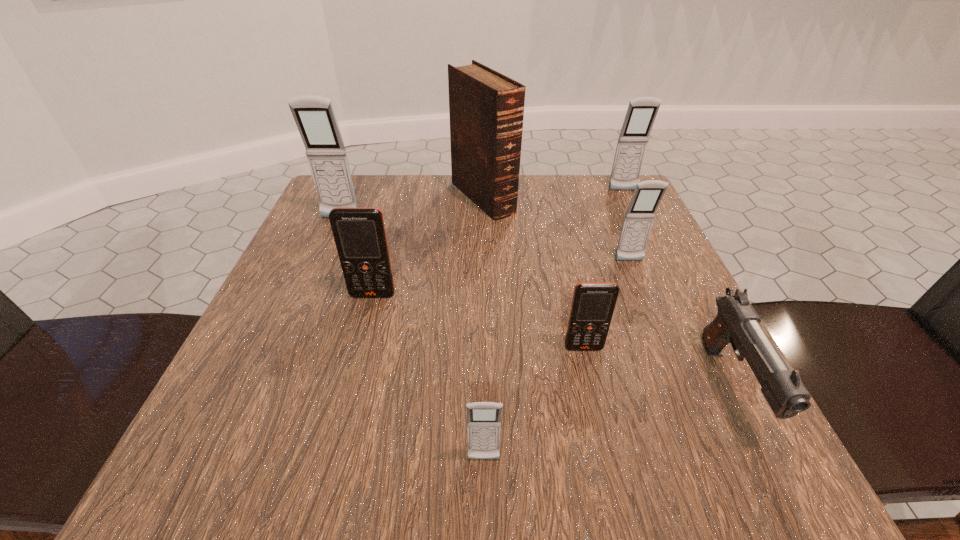
The image size is (960, 540). Find the location of `Bible`. Bible is located at coordinates (486, 108).

You are a GUI agent. You are given a task and a screenshot of the screen. Output one action in this format:
    pyautogui.click(x=<x>, y=<y>)
    Task: Click on the leftmost gray cellular telephone
    The width and height of the screenshot is (960, 540).
    Given the screenshot: What is the action you would take?
    pyautogui.click(x=314, y=116)

At what (x,y) coordinates should I click in order to perform the action: click on the tallest cellular telephone. Please return your answer as a coordinate pair (x, y). Looking at the image, I should click on (314, 116).

You are a GUI agent. You are given a task and a screenshot of the screen. Output one action in this format:
    pyautogui.click(x=<x>, y=<y>)
    Task: Click on the sixth shortest object
    The height and width of the screenshot is (540, 960).
    Given the screenshot: What is the action you would take?
    pyautogui.click(x=641, y=113)

Image resolution: width=960 pixels, height=540 pixels. I want to click on the farthest cellular telephone, so click(x=641, y=113).

Where is `the third biggest gray cellular telephone`? This screenshot has height=540, width=960. the third biggest gray cellular telephone is located at coordinates point(647,196).

At what (x,y) coordinates should I click in order to perform the action: click on the fifth nearest object. Please return your answer as a coordinate pair (x, y). This screenshot has height=540, width=960. Looking at the image, I should click on (647, 196).

You are a GUI agent. You are given a task and a screenshot of the screen. Output one action in this format:
    pyautogui.click(x=<x>, y=<y>)
    Task: Click on the left orange cellular telephone
    Image resolution: width=960 pixels, height=540 pixels.
    Given the screenshot: What is the action you would take?
    pyautogui.click(x=359, y=232)

The image size is (960, 540). In order to click on the third nearest cellular telephone in this screenshot , I will do `click(359, 232)`.

This screenshot has height=540, width=960. In order to click on the second nearest cellular telephone in this screenshot , I will do pyautogui.click(x=593, y=303).